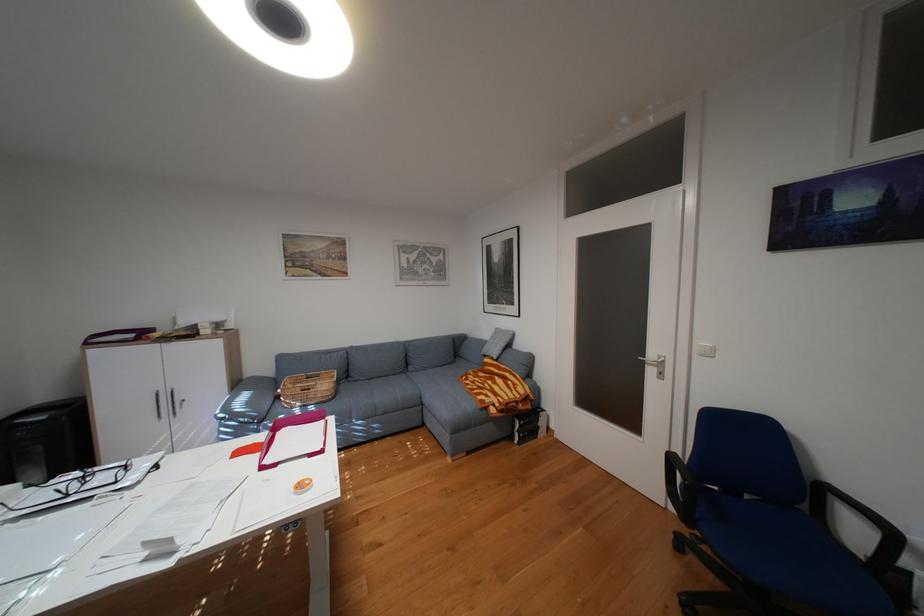
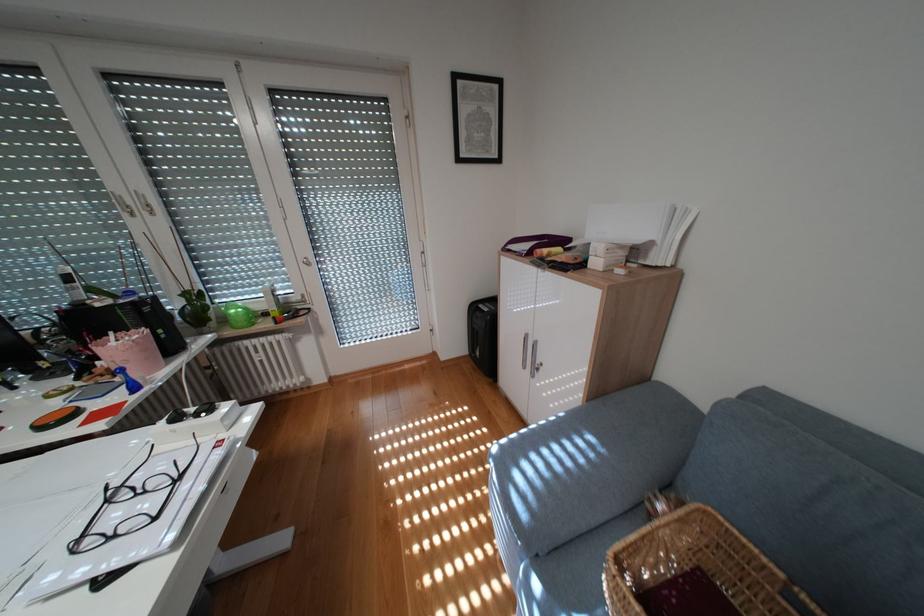
The point at (79, 495) is marked in the first image. Where is the corresponding point in the second image?

(119, 501)